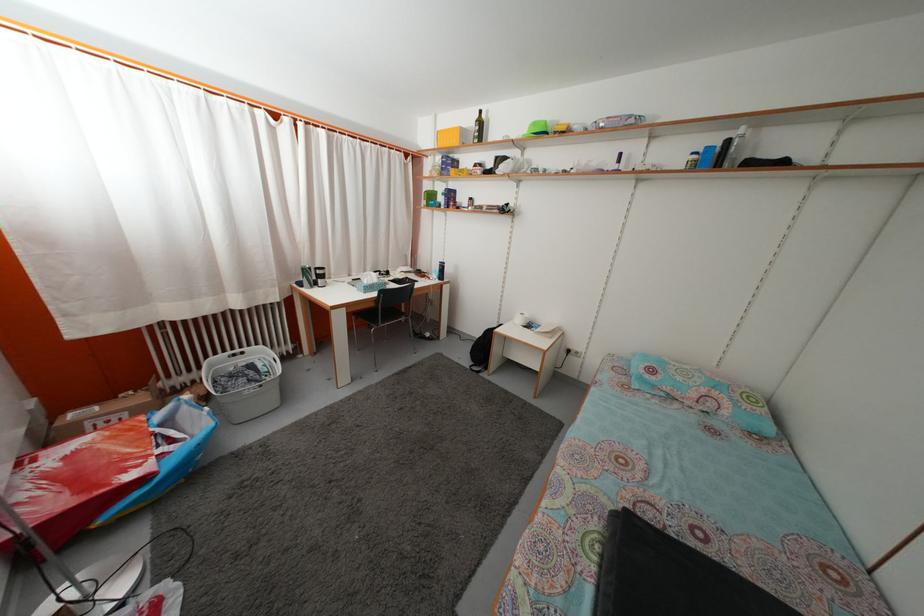
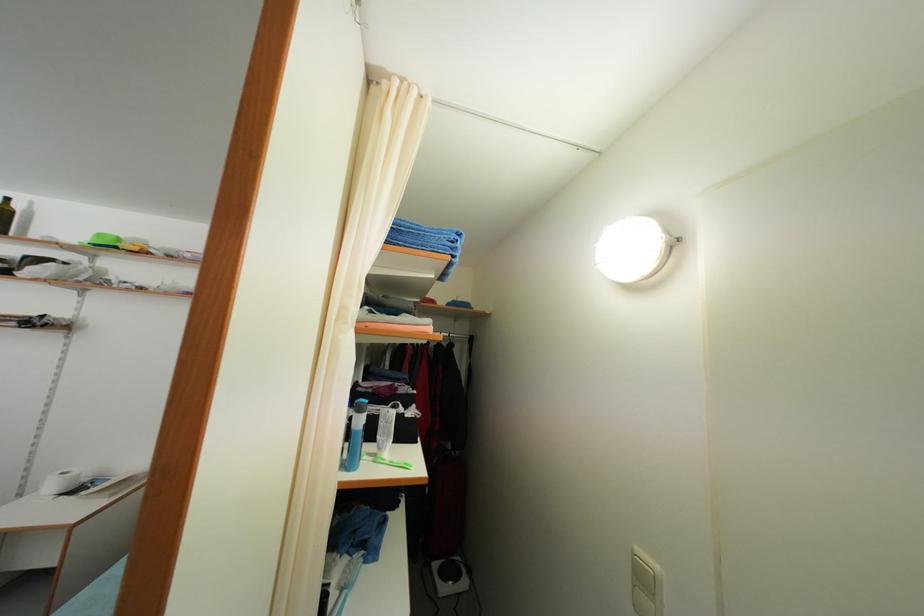
Where in the second image is the point corresponding to point (525, 328) from the first image?

(56, 493)